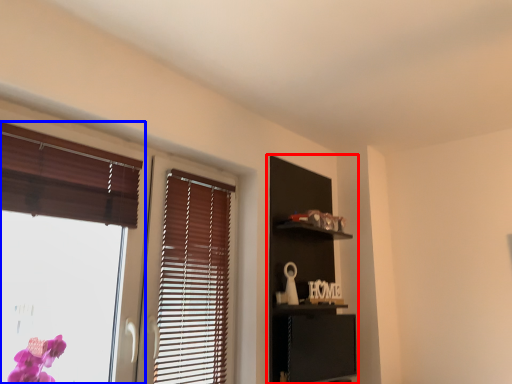
Question: Which of the following is the farthest to the observer, dresser (highlighted by a red box) or window (highlighted by a blue box)?

Choices:
 (A) dresser
 (B) window

Answer: (A)